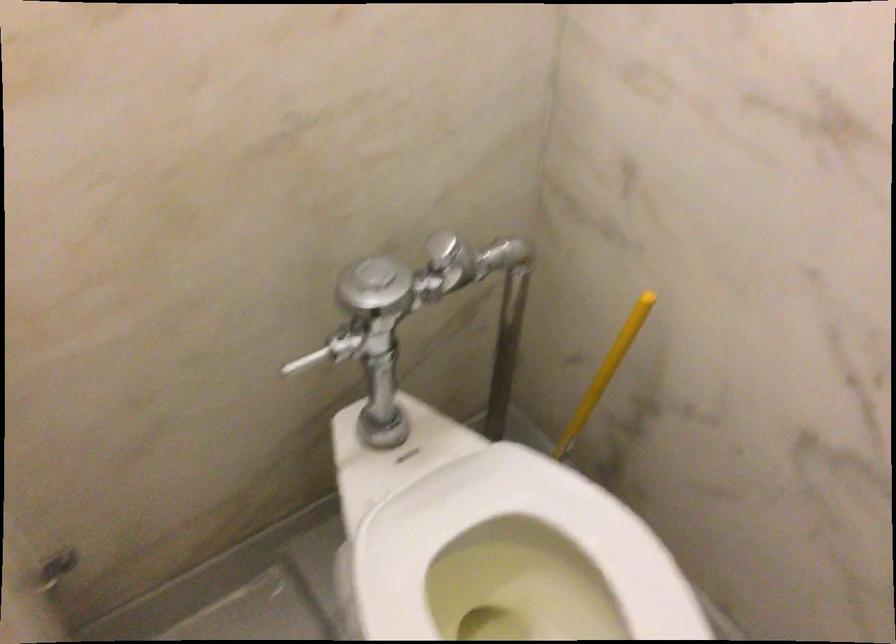
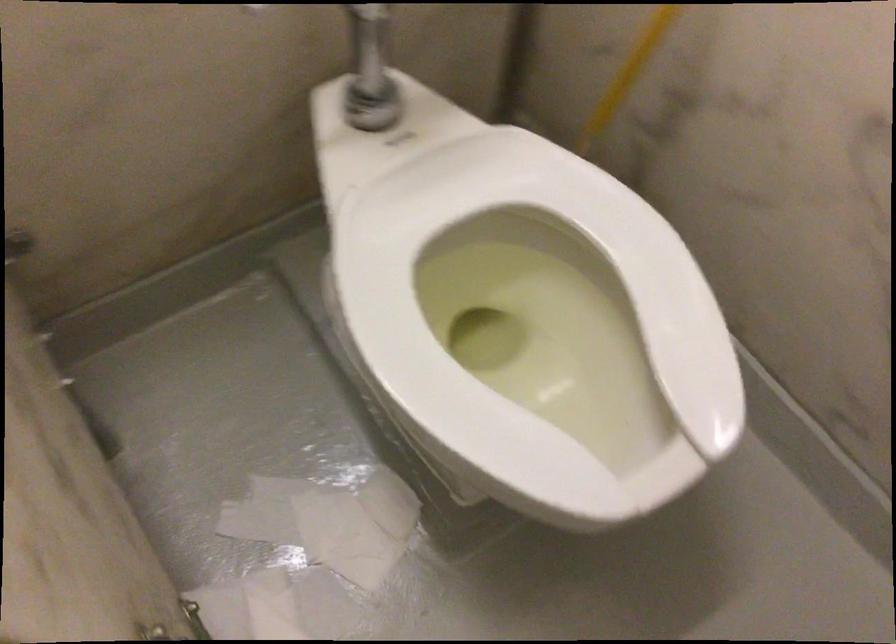
In the second image, find the point that corresponds to point (373, 422) in the first image.

(362, 96)